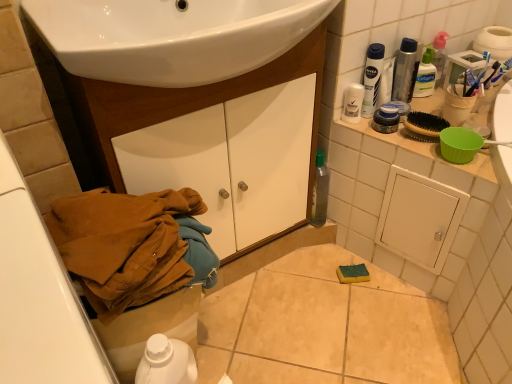
You are a GUI agent. You are given a task and a screenshot of the screen. Output one action in this format:
    pyautogui.click(x=<x>, y=<y>)
    Task: Click on the vacant space to the right of clear plastic bottle at upper right, acting as the 1th toiletry starting from the top
    
    Given the screenshot: What is the action you would take?
    pyautogui.click(x=477, y=100)